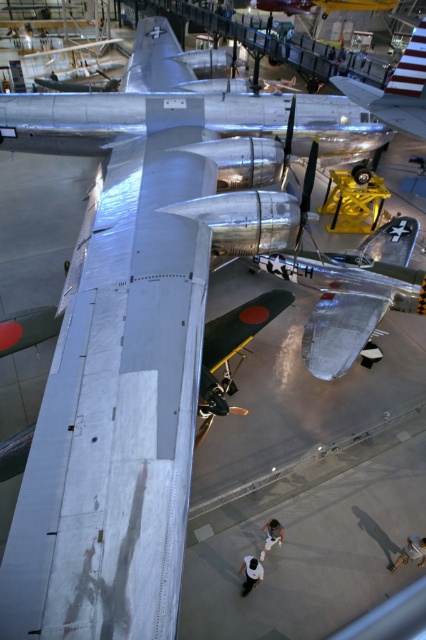
Question: Which object is positioned farthest from the silver metallic airplane at upper center?

Choices:
 (A) white matte shirt at center
 (B) white fabric shirt at center

Answer: (A)

Question: Does polished silver airplane at center appear under silver metallic airplane at upper center?

Choices:
 (A) no
 (B) yes

Answer: (B)

Question: Which point is closer to the camera taking this photo?

Choices:
 (A) (412, 300)
 (B) (267, 531)

Answer: (B)

Question: Is white matte shirt at center to the right of white fabric shirt at center from the viewer's perspective?

Choices:
 (A) yes
 (B) no

Answer: (B)

Question: Is silver metallic airplane at upper center to the left of white fabric shirt at center from the viewer's perspective?

Choices:
 (A) no
 (B) yes

Answer: (A)

Question: Which is nearer to the polished silver airplane at center?

Choices:
 (A) white fabric shirt at center
 (B) white matte shirt at center
 (C) silver metallic airplane at upper center
 (D) white fabric bag at lower right

Answer: (C)